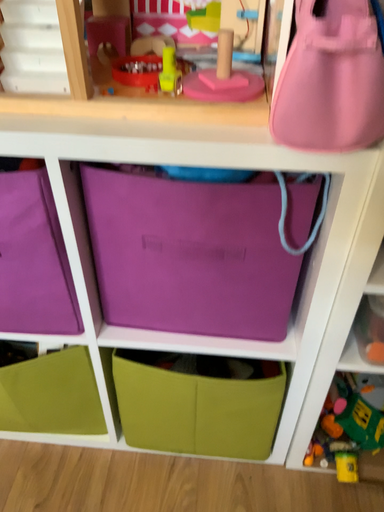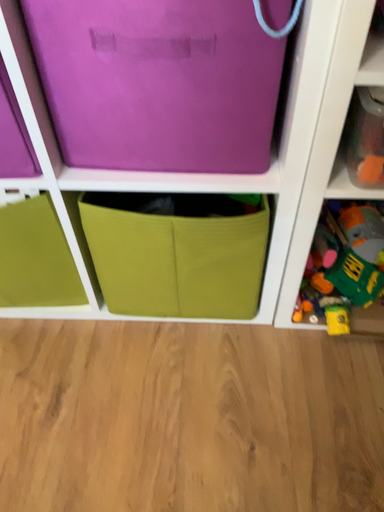
Question: Which way did the camera rotate in the video?

Choices:
 (A) rotated upward
 (B) rotated downward

Answer: (B)